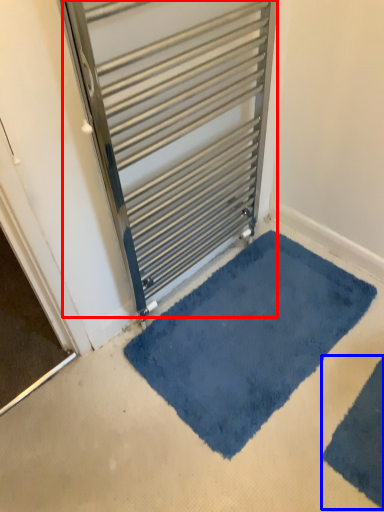
Question: Among these objects, which one is nearest to the camera, door (highlighted by a red box) or bath mat (highlighted by a blue box)?

Choices:
 (A) door
 (B) bath mat

Answer: (A)